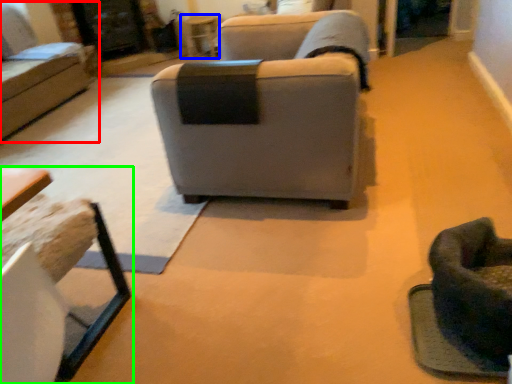
Question: Which is nearer to the studio couch (highlighted by a red box)? table (highlighted by a blue box) or table (highlighted by a green box).

Choices:
 (A) table
 (B) table

Answer: (A)